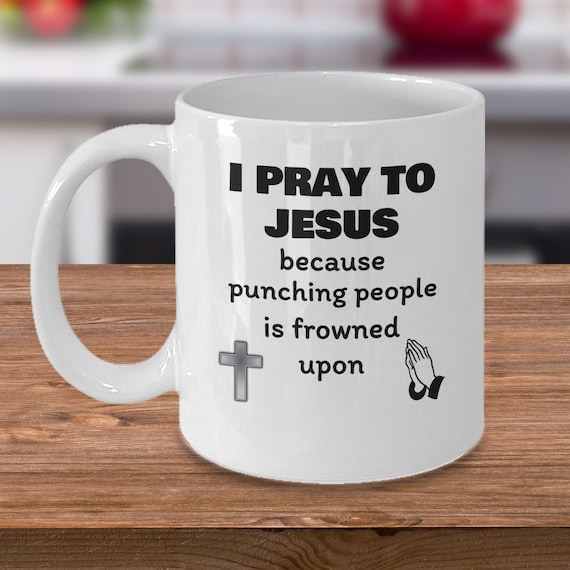
Locate an element on the screen. grey cross on lower left corner of cup is located at coordinates (238, 373).